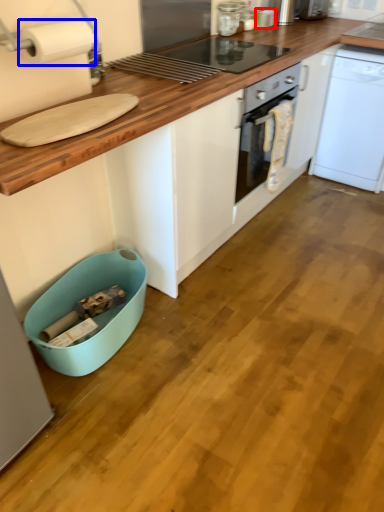
Question: Which of the following is the farthest to the observer, appliance (highlighted by a red box) or paper towel (highlighted by a blue box)?

Choices:
 (A) appliance
 (B) paper towel

Answer: (A)